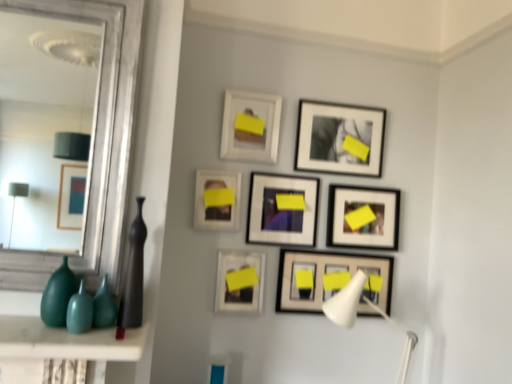
Question: Can you confirm if teal glass vase at lower left, which is counted as the second glass vase, starting from the right, is positioned to the right of green glass vase at lower left, the first glass vase when ordered from right to left?

Choices:
 (A) yes
 (B) no

Answer: (B)

Question: Is teal glass vase at lower left, which is counted as the second glass vase, starting from the right, with green glass vase at lower left, placed as the 2th glass vase when sorted from left to right?

Choices:
 (A) no
 (B) yes

Answer: (A)

Question: Is teal glass vase at lower left, which is counted as the second glass vase, starting from the right, thinner than green glass vase at lower left, the first glass vase when ordered from right to left?

Choices:
 (A) no
 (B) yes

Answer: (A)

Question: From a real-world perspective, is teal glass vase at lower left, which is counted as the second glass vase, starting from the right, positioned over green glass vase at lower left, placed as the 2th glass vase when sorted from left to right, based on gravity?

Choices:
 (A) no
 (B) yes

Answer: (B)

Question: Is teal glass vase at lower left, which ranks as the 1th glass vase in left-to-right order, positioned beyond the bounds of green glass vase at lower left, placed as the 2th glass vase when sorted from left to right?

Choices:
 (A) no
 (B) yes

Answer: (B)

Question: From the image's perspective, is teal glass vase at lower left, which is counted as the second glass vase, starting from the right, below green glass vase at lower left, placed as the 2th glass vase when sorted from left to right?

Choices:
 (A) no
 (B) yes

Answer: (A)

Question: Considering the relative sizes of matte white picture frame at center, which is counted as the 6th picture frame, starting from the top, and green glass vase at lower left, placed as the 2th glass vase when sorted from left to right, in the image provided, is matte white picture frame at center, which is counted as the 6th picture frame, starting from the top, wider than green glass vase at lower left, placed as the 2th glass vase when sorted from left to right,?

Choices:
 (A) yes
 (B) no

Answer: (B)

Question: From the image's perspective, would you say matte white picture frame at center, which is counted as the 6th picture frame, starting from the top, is shown under green glass vase at lower left, placed as the 2th glass vase when sorted from left to right?

Choices:
 (A) no
 (B) yes

Answer: (B)

Question: Can you confirm if matte white picture frame at center, marked as the third picture frame in a bottom-to-top arrangement, is positioned to the right of green glass vase at lower left, placed as the 2th glass vase when sorted from left to right?

Choices:
 (A) yes
 (B) no

Answer: (A)

Question: Is green glass vase at lower left, placed as the 2th glass vase when sorted from left to right, at the back of matte white picture frame at center, marked as the third picture frame in a bottom-to-top arrangement?

Choices:
 (A) yes
 (B) no

Answer: (B)

Question: Is matte white picture frame at center, marked as the third picture frame in a bottom-to-top arrangement, oriented towards green glass vase at lower left, the first glass vase when ordered from right to left?

Choices:
 (A) yes
 (B) no

Answer: (B)

Question: Is matte white picture frame at center, which is counted as the 6th picture frame, starting from the top, positioned in front of green glass vase at lower left, placed as the 2th glass vase when sorted from left to right?

Choices:
 (A) no
 (B) yes

Answer: (A)

Question: Is matte white picture frame at center-left, the 3th picture frame positioned from the top, not within matte white picture frame at upper center, the 1th picture frame positioned from the top?

Choices:
 (A) no
 (B) yes

Answer: (B)